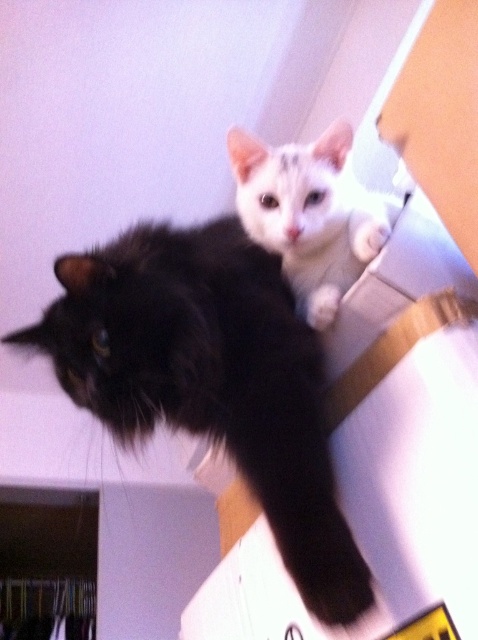
Does black fluffy cat at upper center have a larger size compared to white soft fur cat at upper center?

Indeed, black fluffy cat at upper center has a larger size compared to white soft fur cat at upper center.

Between point (328, 577) and point (250, 198), which one is positioned behind?

Point (250, 198)

Image resolution: width=478 pixels, height=640 pixels. Identify the location of black fluffy cat at upper center. (210, 378).

Between white soft fur cat at upper center and white fur at upper center, which one appears on the left side from the viewer's perspective?

From the viewer's perspective, white soft fur cat at upper center appears more on the left side.

Between point (325, 227) and point (336, 301), which one is positioned in front?

Positioned in front is point (336, 301).

Is point (291, 275) positioned before point (336, 307)?

No, (291, 275) is further to viewer.

The image size is (478, 640). I want to click on white soft fur cat at upper center, so click(x=304, y=205).

Does white soft fur cat at upper center appear under white fur paw at upper center?

Actually, white soft fur cat at upper center is above white fur paw at upper center.

Between white soft fur cat at upper center and white fur paw at upper center, which one is positioned lower?

Positioned lower is white fur paw at upper center.

Who is more forward, (251, 168) or (364, 220)?

Point (364, 220)

Where is `white soft fur cat at upper center`? Image resolution: width=478 pixels, height=640 pixels. white soft fur cat at upper center is located at coordinates (304, 205).